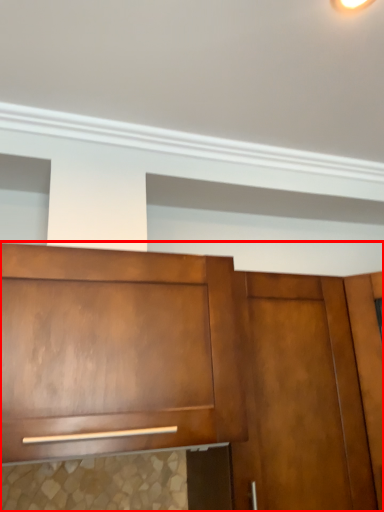
Question: From the image's perspective, considering the relative positions of cabinetry (annotated by the red box) and door in the image provided, where is cabinetry (annotated by the red box) located with respect to the staircase?

Choices:
 (A) above
 (B) below

Answer: (A)